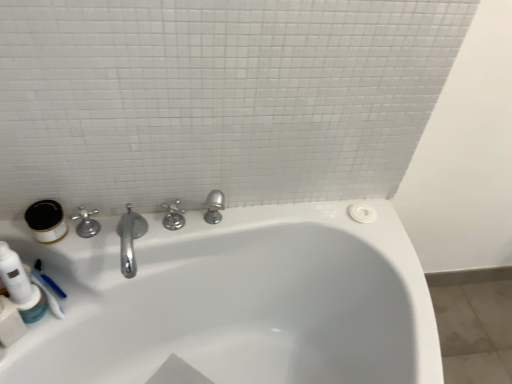
The image size is (512, 384). In order to click on matte white jar at left, the 2th mouthwash positioned from the bottom in this screenshot , I will do coord(46,221).

What do you see at coordinates (46, 221) in the screenshot?
I see `matte white jar at left, the 2th mouthwash positioned from the bottom` at bounding box center [46, 221].

This screenshot has width=512, height=384. Identify the location of polished chrome faucet at left, which ranks as the first tap in left-to-right order. (86, 223).

Does polished chrome faucet at left, placed as the 2th tap when sorted from right to left, have a lesser width compared to white glossy bathtub at center?

Correct, the width of polished chrome faucet at left, placed as the 2th tap when sorted from right to left, is less than that of white glossy bathtub at center.

Which is more to the right, polished chrome faucet at left, which ranks as the first tap in left-to-right order, or white glossy bathtub at center?

white glossy bathtub at center is more to the right.

Does point (97, 210) appear closer or farther from the camera than point (209, 319)?

Point (97, 210) appears to be closer to the viewer than point (209, 319).

How many degrees apart are the facing directions of polished chrome faucet at left, which ranks as the first tap in left-to-right order, and white glossy bathtub at center?

polished chrome faucet at left, which ranks as the first tap in left-to-right order, and white glossy bathtub at center are facing 90 degrees away from each other.

Is translucent plastic mouthwash at lower left, arranged as the 2th mouthwash when viewed from the top, with polished chrome faucet at left, placed as the 2th tap when sorted from right to left?

There is a gap between translucent plastic mouthwash at lower left, arranged as the 2th mouthwash when viewed from the top, and polished chrome faucet at left, placed as the 2th tap when sorted from right to left.

Between translucent plastic mouthwash at lower left, which ranks as the 1th mouthwash in bottom-to-top order, and polished chrome faucet at left, placed as the 2th tap when sorted from right to left, which one has more height?

polished chrome faucet at left, placed as the 2th tap when sorted from right to left, is taller.

Would you say translucent plastic mouthwash at lower left, arranged as the 2th mouthwash when viewed from the top, contains polished chrome faucet at left, which ranks as the first tap in left-to-right order?

No, translucent plastic mouthwash at lower left, arranged as the 2th mouthwash when viewed from the top, does not contain polished chrome faucet at left, which ranks as the first tap in left-to-right order.

Is polished chrome faucet at center, which is counted as the 2th tap, starting from the left, to the left of white glossy bathtub at center from the viewer's perspective?

Correct, you'll find polished chrome faucet at center, which is counted as the 2th tap, starting from the left, to the left of white glossy bathtub at center.

Does polished chrome faucet at center, which is counted as the 2th tap, starting from the left, have a lesser width compared to white glossy bathtub at center?

Indeed, polished chrome faucet at center, which is counted as the 2th tap, starting from the left, has a lesser width compared to white glossy bathtub at center.

Consider the image. From a real-world perspective, is polished chrome faucet at center, which is counted as the 2th tap, starting from the left, physically below white glossy bathtub at center?

No, from a real-world perspective, polished chrome faucet at center, which is counted as the 2th tap, starting from the left, is not beneath white glossy bathtub at center.

Is polished chrome faucet at center, which is the 1th tap in right-to-left order, bigger than white glossy bathtub at center?

Incorrect, polished chrome faucet at center, which is the 1th tap in right-to-left order, is not larger than white glossy bathtub at center.

Does point (330, 251) appear closer or farther from the camera than point (183, 226)?

Clearly, point (330, 251) is more distant from the camera than point (183, 226).

Looking at this image, from a real-world perspective, between white glossy bathtub at center and polished chrome faucet at center, which is the 1th tap in right-to-left order, who is vertically lower?

white glossy bathtub at center.

Looking at the image, does white glossy bathtub at center seem bigger or smaller compared to polished chrome faucet at center, which is the 1th tap in right-to-left order?

white glossy bathtub at center is bigger than polished chrome faucet at center, which is the 1th tap in right-to-left order.

Is polished chrome faucet at center, which is the 1th tap in right-to-left order, positioned beyond the bounds of translucent plastic mouthwash at lower left, arranged as the 2th mouthwash when viewed from the top?

polished chrome faucet at center, which is the 1th tap in right-to-left order, lies outside translucent plastic mouthwash at lower left, arranged as the 2th mouthwash when viewed from the top,'s area.

In the scene shown: Does polished chrome faucet at center, which is counted as the 2th tap, starting from the left, turn towards translucent plastic mouthwash at lower left, which ranks as the 1th mouthwash in bottom-to-top order?

No, polished chrome faucet at center, which is counted as the 2th tap, starting from the left, is not facing towards translucent plastic mouthwash at lower left, which ranks as the 1th mouthwash in bottom-to-top order.

Is polished chrome faucet at center, which is counted as the 2th tap, starting from the left, not near translucent plastic mouthwash at lower left, arranged as the 2th mouthwash when viewed from the top?

No.

Find the location of `mouthwash that is the 1st one when counting forward from the polished chrome faucet at center, which is counted as the 2th tap, starting from the left`. mouthwash that is the 1st one when counting forward from the polished chrome faucet at center, which is counted as the 2th tap, starting from the left is located at coordinates (33, 306).

Does point (87, 289) appear closer or farther from the camera than point (24, 308)?

Point (87, 289) is positioned farther from the camera compared to point (24, 308).

How much distance is there between white glossy bathtub at center and translucent plastic mouthwash at lower left, which ranks as the 1th mouthwash in bottom-to-top order?

white glossy bathtub at center and translucent plastic mouthwash at lower left, which ranks as the 1th mouthwash in bottom-to-top order, are 21.12 inches apart from each other.

Which of these two, white glossy bathtub at center or translucent plastic mouthwash at lower left, which ranks as the 1th mouthwash in bottom-to-top order, is smaller?

translucent plastic mouthwash at lower left, which ranks as the 1th mouthwash in bottom-to-top order, is smaller.

Considering the relative sizes of white glossy bathtub at center and translucent plastic mouthwash at lower left, which ranks as the 1th mouthwash in bottom-to-top order, in the image provided, is white glossy bathtub at center wider than translucent plastic mouthwash at lower left, which ranks as the 1th mouthwash in bottom-to-top order,?

Correct, the width of white glossy bathtub at center exceeds that of translucent plastic mouthwash at lower left, which ranks as the 1th mouthwash in bottom-to-top order.

Is translucent plastic mouthwash at lower left, which ranks as the 1th mouthwash in bottom-to-top order, not inside polished chrome faucet at center, which is counted as the 2th tap, starting from the left?

That's correct, translucent plastic mouthwash at lower left, which ranks as the 1th mouthwash in bottom-to-top order, is outside of polished chrome faucet at center, which is counted as the 2th tap, starting from the left.

Does translucent plastic mouthwash at lower left, arranged as the 2th mouthwash when viewed from the top, turn towards polished chrome faucet at center, which is the 1th tap in right-to-left order?

No, translucent plastic mouthwash at lower left, arranged as the 2th mouthwash when viewed from the top, is not aimed at polished chrome faucet at center, which is the 1th tap in right-to-left order.

Based on the photo, which object is positioned more to the left, translucent plastic mouthwash at lower left, arranged as the 2th mouthwash when viewed from the top, or polished chrome faucet at center, which is counted as the 2th tap, starting from the left?

translucent plastic mouthwash at lower left, arranged as the 2th mouthwash when viewed from the top, is more to the left.

In the image, there is a polished chrome faucet at left, placed as the 2th tap when sorted from right to left. Find the location of `bathtub below it (from a real-world perspective)`. bathtub below it (from a real-world perspective) is located at coordinates (236, 301).

Starting from the polished chrome faucet at left, which ranks as the first tap in left-to-right order, which mouthwash is the 2nd one to the left? Please provide its 2D coordinates.

[(33, 306)]

From the image, which object appears to be nearer to polished chrome faucet at center, which is the 1th tap in right-to-left order, white glossy bathtub at center or translucent plastic mouthwash at lower left, which ranks as the 1th mouthwash in bottom-to-top order?

Based on the image, translucent plastic mouthwash at lower left, which ranks as the 1th mouthwash in bottom-to-top order, appears to be nearer to polished chrome faucet at center, which is the 1th tap in right-to-left order.

Looking at the image, which one is located closer to translucent plastic mouthwash at lower left, which ranks as the 1th mouthwash in bottom-to-top order, polished chrome faucet at left, which ranks as the first tap in left-to-right order, or white glossy bathtub at center?

The object closer to translucent plastic mouthwash at lower left, which ranks as the 1th mouthwash in bottom-to-top order, is polished chrome faucet at left, which ranks as the first tap in left-to-right order.

Looking at the image, which one is located closer to matte white jar at left, the 1th mouthwash positioned from the top, translucent plastic mouthwash at lower left, which ranks as the 1th mouthwash in bottom-to-top order, or polished chrome faucet at left, placed as the 2th tap when sorted from right to left?

polished chrome faucet at left, placed as the 2th tap when sorted from right to left, is closer to matte white jar at left, the 1th mouthwash positioned from the top.

Based on their spatial positions, is polished chrome faucet at left, which ranks as the first tap in left-to-right order, or matte white jar at left, the 2th mouthwash positioned from the bottom, closer to polished chrome faucet at center, which is counted as the 2th tap, starting from the left?

polished chrome faucet at left, which ranks as the first tap in left-to-right order, is closer to polished chrome faucet at center, which is counted as the 2th tap, starting from the left.

From the image, which object appears to be farther from polished chrome faucet at left, placed as the 2th tap when sorted from right to left, white glossy bathtub at center or translucent plastic mouthwash at lower left, which ranks as the 1th mouthwash in bottom-to-top order?

The object further to polished chrome faucet at left, placed as the 2th tap when sorted from right to left, is white glossy bathtub at center.

When comparing their distances from translucent plastic mouthwash at lower left, arranged as the 2th mouthwash when viewed from the top, does polished chrome faucet at left, placed as the 2th tap when sorted from right to left, or matte white jar at left, the 1th mouthwash positioned from the top, seem closer?

matte white jar at left, the 1th mouthwash positioned from the top.

Which object lies nearer to the anchor point white glossy bathtub at center, polished chrome faucet at left, which ranks as the first tap in left-to-right order, or polished chrome faucet at center, which is counted as the 2th tap, starting from the left?

Based on the image, polished chrome faucet at center, which is counted as the 2th tap, starting from the left, appears to be nearer to white glossy bathtub at center.

Looking at the image, which one is located further to translucent plastic mouthwash at lower left, which ranks as the 1th mouthwash in bottom-to-top order, polished chrome faucet at left, placed as the 2th tap when sorted from right to left, or polished chrome faucet at center, which is counted as the 2th tap, starting from the left?

polished chrome faucet at center, which is counted as the 2th tap, starting from the left, is further to translucent plastic mouthwash at lower left, which ranks as the 1th mouthwash in bottom-to-top order.

Identify the location of tap between white glossy bathtub at center and polished chrome faucet at center, which is the 1th tap in right-to-left order, along the z-axis. (86, 223).

You are a GUI agent. You are given a task and a screenshot of the screen. Output one action in this format:
    pyautogui.click(x=<x>, y=<y>)
    Task: Click on the tap located between matte white jar at left, the 1th mouthwash positioned from the top, and polished chrome faucet at center, which is the 1th tap in right-to-left order, in the left-right direction
    The width and height of the screenshot is (512, 384).
    Given the screenshot: What is the action you would take?
    pyautogui.click(x=86, y=223)

Locate an element on the screen. mouthwash between polished chrome faucet at left, placed as the 2th tap when sorted from right to left, and translucent plastic mouthwash at lower left, arranged as the 2th mouthwash when viewed from the top, in the vertical direction is located at coordinates (46, 221).

Find the location of a particular element. This screenshot has width=512, height=384. mouthwash between translucent plastic mouthwash at lower left, arranged as the 2th mouthwash when viewed from the top, and polished chrome faucet at center, which is the 1th tap in right-to-left order, from left to right is located at coordinates (46, 221).